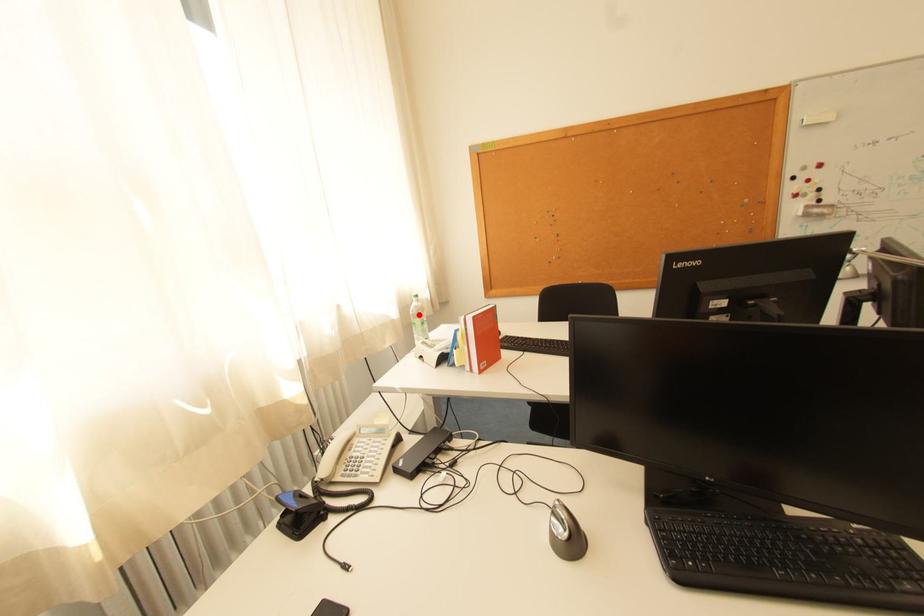
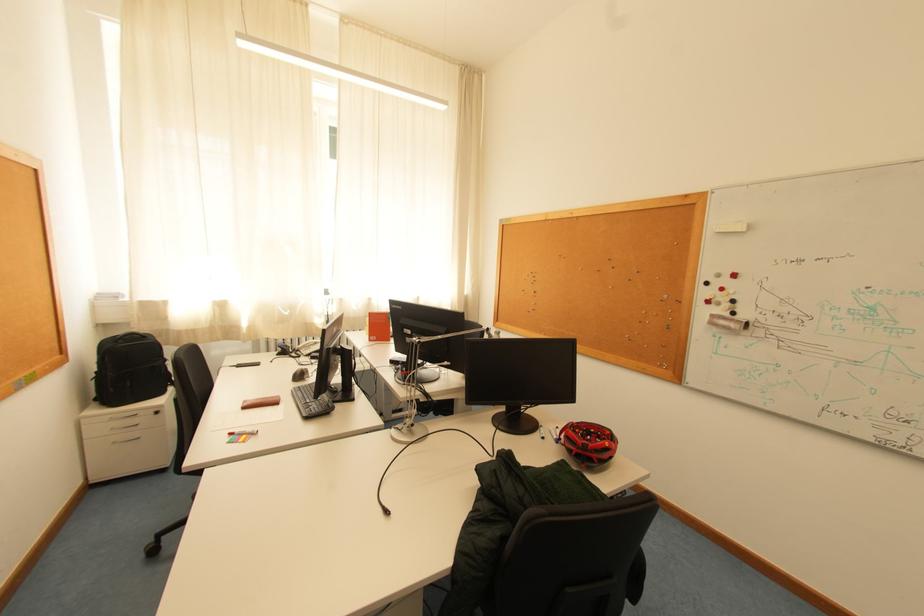
Question: I am providing you with two images of the same scene from different viewpoints. A red point is marked on the first image. Can you still see the location of the red point in image 2?

Choices:
 (A) Yes
 (B) No

Answer: (B)